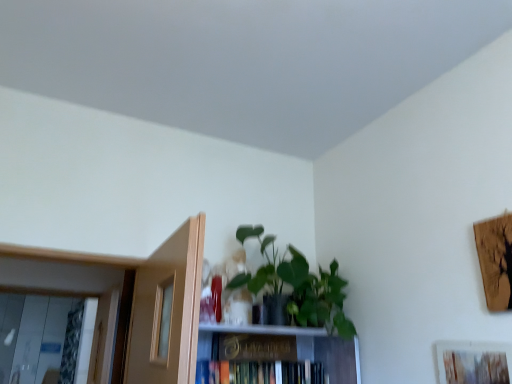
What do you see at coordinates (251, 372) in the screenshot?
I see `hardcover book at center` at bounding box center [251, 372].

The height and width of the screenshot is (384, 512). Describe the element at coordinates (298, 286) in the screenshot. I see `green matte plant at upper center` at that location.

The height and width of the screenshot is (384, 512). I want to click on hardcover book at center, so click(251, 372).

What's the angular difference between hardcover book at center and wooden textured picture frame at lower right's facing directions?

hardcover book at center and wooden textured picture frame at lower right are facing 90 degrees away from each other.

What are the coordinates of `picture frame above the hardcover book at center (from the image's perspective)` in the screenshot? It's located at (474, 363).

Which is closer to the camera, (274,370) or (461,372)?

The point (461,372) is more forward.

From a real-world perspective, which object stands above the other?

From a 3D spatial view, wooden textured picture frame at lower right is above.

Considering the relative sizes of hardcover book at center and gold metallic paperback book at center in the image provided, is hardcover book at center shorter than gold metallic paperback book at center?

No.

Consider the image. Does hardcover book at center have a greater width compared to gold metallic paperback book at center?

In fact, hardcover book at center might be narrower than gold metallic paperback book at center.

Is the depth of hardcover book at center greater than that of gold metallic paperback book at center?

No, hardcover book at center is closer to the viewer.

The width and height of the screenshot is (512, 384). Identify the location of book below the gold metallic paperback book at center (from the image's perspective). (251, 372).

From a real-world perspective, is green matte plant at upper center positioned above or below gold metallic paperback book at center?

green matte plant at upper center is situated higher than gold metallic paperback book at center in the real world.

How different are the orientations of green matte plant at upper center and gold metallic paperback book at center in degrees?

The angle between the facing direction of green matte plant at upper center and the facing direction of gold metallic paperback book at center is 0.000547 degrees.

Visually, is green matte plant at upper center positioned to the left or to the right of gold metallic paperback book at center?

From the image, it's evident that green matte plant at upper center is to the right of gold metallic paperback book at center.

Can you confirm if green matte plant at upper center is shorter than gold metallic paperback book at center?

No, green matte plant at upper center is not shorter than gold metallic paperback book at center.

From the image's perspective, is green matte plant at upper center over wooden textured picture frame at lower right?

Correct, green matte plant at upper center appears higher than wooden textured picture frame at lower right in the image.

Who is taller, green matte plant at upper center or wooden textured picture frame at lower right?

green matte plant at upper center is taller.

How many degrees apart are the facing directions of green matte plant at upper center and wooden textured picture frame at lower right?

90 degrees.

Is green matte plant at upper center looking in the opposite direction of wooden textured picture frame at lower right?

No, wooden textured picture frame at lower right is not at the back of green matte plant at upper center.

Is gold metallic paperback book at center to the right of wooden textured picture frame at lower right from the viewer's perspective?

Incorrect, gold metallic paperback book at center is not on the right side of wooden textured picture frame at lower right.

Does gold metallic paperback book at center have a lesser width compared to wooden textured picture frame at lower right?

No.

Considering the relative positions of gold metallic paperback book at center and wooden textured picture frame at lower right in the image provided, is gold metallic paperback book at center behind wooden textured picture frame at lower right?

That is True.

Can you confirm if wooden textured picture frame at lower right is smaller than gold metallic paperback book at center?

Yes.

Is wooden textured picture frame at lower right completely or partially outside of gold metallic paperback book at center?

Yes, wooden textured picture frame at lower right is not within gold metallic paperback book at center.

In the scene shown: Is wooden textured picture frame at lower right positioned in front of gold metallic paperback book at center?

Yes, it is in front of gold metallic paperback book at center.

Is point (478, 379) positioned after point (289, 360)?

No, it is not.

Considering the sizes of objects gold metallic paperback book at center and hardcover book at center in the image provided, who is taller, gold metallic paperback book at center or hardcover book at center?

hardcover book at center.

Where is `paperback book above the hardcover book at center (from the image's perspective)`? paperback book above the hardcover book at center (from the image's perspective) is located at coordinates (257, 347).

Would you say gold metallic paperback book at center is a long distance from hardcover book at center?

gold metallic paperback book at center is actually quite close to hardcover book at center.

From a real-world perspective, is gold metallic paperback book at center above or below hardcover book at center?

Clearly, from a real-world perspective, gold metallic paperback book at center is above hardcover book at center.

In order to click on book behind the wooden textured picture frame at lower right in this screenshot , I will do `click(251, 372)`.

Identify the location of book on the right of gold metallic paperback book at center. (251, 372).

Considering their positions, is hardcover book at center positioned further to wooden textured picture frame at lower right than gold metallic paperback book at center?

hardcover book at center is positioned further to the anchor wooden textured picture frame at lower right.

From the image, which object appears to be nearer to wooden textured picture frame at lower right, gold metallic paperback book at center or hardcover book at center?

gold metallic paperback book at center.

Estimate the real-world distances between objects in this image. Which object is further from green matte plant at upper center, wooden textured picture frame at lower right or gold metallic paperback book at center?

wooden textured picture frame at lower right is further to green matte plant at upper center.

Which object lies further to the anchor point hardcover book at center, gold metallic paperback book at center or wooden textured picture frame at lower right?

Among the two, wooden textured picture frame at lower right is located further to hardcover book at center.

Considering their positions, is hardcover book at center positioned further to wooden textured picture frame at lower right than green matte plant at upper center?

Based on the image, hardcover book at center appears to be further to wooden textured picture frame at lower right.

From the image, which object appears to be farther from hardcover book at center, wooden textured picture frame at lower right or gold metallic paperback book at center?

Among the two, wooden textured picture frame at lower right is located further to hardcover book at center.

Looking at the image, which one is located closer to gold metallic paperback book at center, hardcover book at center or green matte plant at upper center?

The object closer to gold metallic paperback book at center is hardcover book at center.

Which object lies further to the anchor point hardcover book at center, wooden textured picture frame at lower right or green matte plant at upper center?

Based on the image, wooden textured picture frame at lower right appears to be further to hardcover book at center.

You are a GUI agent. You are given a task and a screenshot of the screen. Output one action in this format:
    pyautogui.click(x=<x>, y=<y>)
    Task: Click on the paperback book between green matte plant at upper center and hardcover book at center from top to bottom
    The width and height of the screenshot is (512, 384).
    Given the screenshot: What is the action you would take?
    pyautogui.click(x=257, y=347)

Where is `houseplant between gold metallic paperback book at center and wooden textured picture frame at lower right in the horizontal direction`? houseplant between gold metallic paperback book at center and wooden textured picture frame at lower right in the horizontal direction is located at coordinates (298, 286).

This screenshot has width=512, height=384. I want to click on book between gold metallic paperback book at center and wooden textured picture frame at lower right, so click(x=251, y=372).

Where is `houseplant between hardcover book at center and wooden textured picture frame at lower right from left to right`? Image resolution: width=512 pixels, height=384 pixels. houseplant between hardcover book at center and wooden textured picture frame at lower right from left to right is located at coordinates (298, 286).